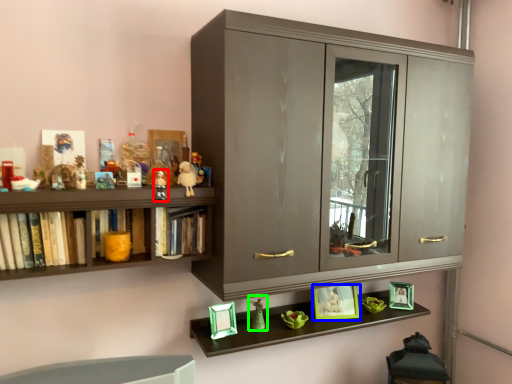
Question: Which object is positioned closest to toy (highlighted by a red box)? Select from picture frame (highlighted by a blue box) and toy (highlighted by a green box).

Choices:
 (A) picture frame
 (B) toy

Answer: (B)